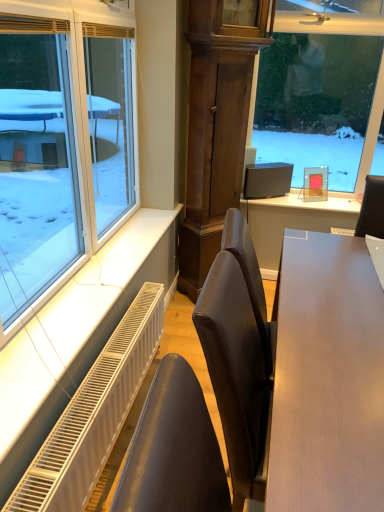
Image resolution: width=384 pixels, height=512 pixels. I want to click on empty space that is ontop of white metal radiator at lower left (from a real-world perspective), so click(x=99, y=380).